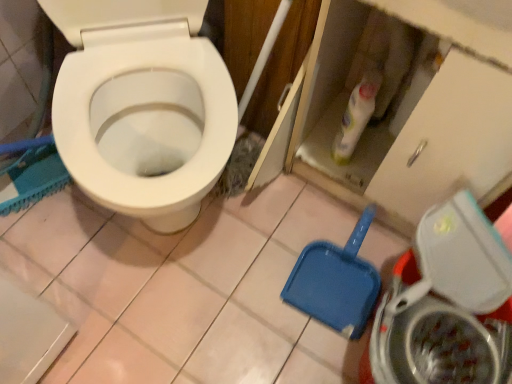
I want to click on vacant space situated on the left part of blue plastic shovel at lower right, so click(x=254, y=259).